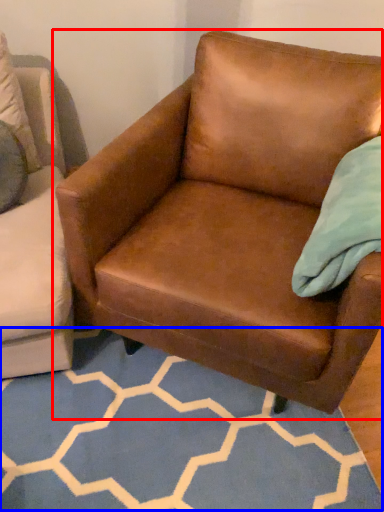
Question: Among these objects, which one is farthest to the camera, chair (highlighted by a red box) or pattern (highlighted by a blue box)?

Choices:
 (A) chair
 (B) pattern

Answer: (B)